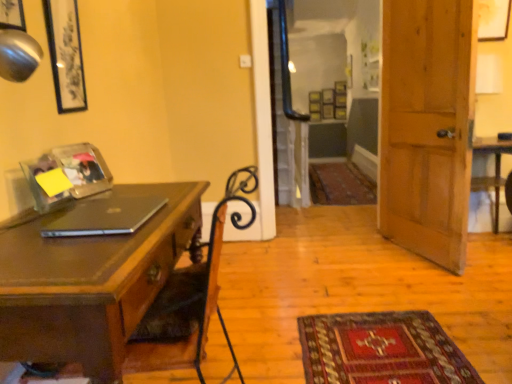
The width and height of the screenshot is (512, 384). Find the location of `clear glass screen door at upper center`. clear glass screen door at upper center is located at coordinates (286, 120).

In order to face carpeted mat at center, should I rotate leftwards or rightwards?

Turn right by 10.792 degrees to look at carpeted mat at center.

Image resolution: width=512 pixels, height=384 pixels. What do you see at coordinates (41, 185) in the screenshot?
I see `clear plastic picture frame at left, the second picture frame viewed from the front` at bounding box center [41, 185].

Describe the element at coordinates (83, 169) in the screenshot. I see `clear plastic picture frame at upper left, which appears as the third picture frame when viewed from the front` at that location.

How much space does clear plastic picture frame at upper left, which is the 2th picture frame from right to left, occupy vertically?

The height of clear plastic picture frame at upper left, which is the 2th picture frame from right to left, is 9.89 inches.

Find the location of a particular element. The height and width of the screenshot is (384, 512). clear glass screen door at upper center is located at coordinates (286, 120).

Is point (109, 301) farther from camera compared to point (57, 163)?

No, (109, 301) is in front of (57, 163).

Considering the relative positions of wooden desk at left and clear plastic picture frame at upper left, which is the 2th picture frame from right to left, in the image provided, is wooden desk at left to the right of clear plastic picture frame at upper left, which is the 2th picture frame from right to left, from the viewer's perspective?

Yes, wooden desk at left is to the right of clear plastic picture frame at upper left, which is the 2th picture frame from right to left.

Could you tell me if wooden desk at left is facing clear plastic picture frame at upper left, which appears as the fourth picture frame when viewed from the left?

No, wooden desk at left is not facing towards clear plastic picture frame at upper left, which appears as the fourth picture frame when viewed from the left.

From the image's perspective, starting from the wooden desk at left, which picture frame is the 2nd one above? Please provide its 2D coordinates.

[(83, 169)]

From a real-world perspective, is wooden picture frame at upper right, arranged as the fifth picture frame when viewed from the left, positioned over sleek black laptop at left based on gravity?

Yes, from a real-world perspective, wooden picture frame at upper right, arranged as the fifth picture frame when viewed from the left, is over sleek black laptop at left

Is wooden picture frame at upper right, positioned as the first picture frame in back-to-front order, next to sleek black laptop at left and touching it?

wooden picture frame at upper right, positioned as the first picture frame in back-to-front order, is not next to sleek black laptop at left, and they're not touching.

Would you say sleek black laptop at left is part of wooden picture frame at upper right, the first picture frame positioned from the right,'s contents?

No, sleek black laptop at left is not surrounded by wooden picture frame at upper right, the first picture frame positioned from the right.

Is there a large distance between clear glass screen door at upper center and clear plastic picture frame at left, the second picture frame viewed from the front?

Yes, clear glass screen door at upper center and clear plastic picture frame at left, the second picture frame viewed from the front, are quite far apart.

Is the depth of clear glass screen door at upper center less than that of clear plastic picture frame at left, marked as the 3th picture frame in a right-to-left arrangement?

No, clear glass screen door at upper center is further to the viewer.

From the image's perspective, is clear glass screen door at upper center on top of clear plastic picture frame at left, marked as the fourth picture frame in a back-to-front arrangement?

Yes.

How far apart are clear glass screen door at upper center and clear plastic picture frame at left, the second picture frame viewed from the front?

A distance of 8.92 feet exists between clear glass screen door at upper center and clear plastic picture frame at left, the second picture frame viewed from the front.

Which of these two, wooden desk at left or matte black picture frame at upper left, which is counted as the 5th picture frame, starting from the right, stands taller?

With more height is wooden desk at left.

Who is more distant, wooden desk at left or matte black picture frame at upper left, the 1th picture frame from the front?

matte black picture frame at upper left, the 1th picture frame from the front, is further away from the camera.

Could you measure the distance between wooden desk at left and matte black picture frame at upper left, the fifth picture frame in the back-to-front sequence?

wooden desk at left and matte black picture frame at upper left, the fifth picture frame in the back-to-front sequence, are 24.80 inches apart.

Does point (9, 247) appear closer or farther from the camera than point (9, 27)?

Point (9, 247).

From a real-world perspective, is wooden door at right over matte black picture frame at upper left, which is the fourth picture frame from front to back?

Actually, wooden door at right is physically below matte black picture frame at upper left, which is the fourth picture frame from front to back, in the real world.

Considering the positions of objects wooden door at right and matte black picture frame at upper left, which is the fourth picture frame from front to back, in the image provided, who is in front, wooden door at right or matte black picture frame at upper left, which is the fourth picture frame from front to back,?

matte black picture frame at upper left, which is the fourth picture frame from front to back, is closer to the camera.

Is point (389, 224) positioned before point (76, 94)?

No, (389, 224) is further to viewer.

From the image's perspective, is wooden door at right located beneath matte black picture frame at upper left, marked as the second picture frame in a back-to-front arrangement?

Correct, wooden door at right appears lower than matte black picture frame at upper left, marked as the second picture frame in a back-to-front arrangement, in the image.

Which of these two, matte black picture frame at upper left, which appears as the first picture frame when viewed from the left, or matte black picture frame at upper left, which is the fourth picture frame from front to back, is wider?

matte black picture frame at upper left, which appears as the first picture frame when viewed from the left, is wider.

Does matte black picture frame at upper left, the 1th picture frame from the front, turn towards matte black picture frame at upper left, which is the fourth picture frame from front to back?

No.

Could you measure the distance between matte black picture frame at upper left, the 1th picture frame from the front, and matte black picture frame at upper left, which is the fourth picture frame from front to back?

They are 20.84 inches apart.

Is clear plastic picture frame at left, marked as the 3th picture frame in a right-to-left arrangement, oriented away from clear plastic picture frame at upper left, which appears as the third picture frame when viewed from the front?

No.

From the image's perspective, is clear plastic picture frame at left, the second picture frame viewed from the front, over clear plastic picture frame at upper left, which is the third picture frame in back-to-front order?

No, from the image's perspective, clear plastic picture frame at left, the second picture frame viewed from the front, is not above clear plastic picture frame at upper left, which is the third picture frame in back-to-front order.

From a real-world perspective, is clear plastic picture frame at left, marked as the 3th picture frame in a right-to-left arrangement, located higher than clear plastic picture frame at upper left, which appears as the third picture frame when viewed from the front?

No, from a real-world perspective, clear plastic picture frame at left, marked as the 3th picture frame in a right-to-left arrangement, is not over clear plastic picture frame at upper left, which appears as the third picture frame when viewed from the front

In terms of width, does clear plastic picture frame at left, marked as the fourth picture frame in a back-to-front arrangement, look wider or thinner when compared to clear plastic picture frame at upper left, which is the third picture frame in back-to-front order?

Considering their sizes, clear plastic picture frame at left, marked as the fourth picture frame in a back-to-front arrangement, looks slimmer than clear plastic picture frame at upper left, which is the third picture frame in back-to-front order.

This screenshot has width=512, height=384. Find the location of `desk lying on the right of clear plastic picture frame at upper left, which appears as the fourth picture frame when viewed from the left`. desk lying on the right of clear plastic picture frame at upper left, which appears as the fourth picture frame when viewed from the left is located at coordinates (91, 284).

The width and height of the screenshot is (512, 384). Find the location of `picture frame that is the 5th one when counting upward from the sleek black laptop at left (from the image's perspective)`. picture frame that is the 5th one when counting upward from the sleek black laptop at left (from the image's perspective) is located at coordinates (493, 19).

From the picture: From the image, which object appears to be farther from wooden picture frame at upper right, arranged as the fifth picture frame when viewed from the left, wooden desk at left or clear glass screen door at upper center?

Based on the image, wooden desk at left appears to be further to wooden picture frame at upper right, arranged as the fifth picture frame when viewed from the left.

Looking at the image, which one is located closer to matte black picture frame at upper left, which appears as the first picture frame when viewed from the left, clear plastic picture frame at left, which is the 3th picture frame from left to right, or carpeted mat at center?

Based on the image, clear plastic picture frame at left, which is the 3th picture frame from left to right, appears to be nearer to matte black picture frame at upper left, which appears as the first picture frame when viewed from the left.

Estimate the real-world distances between objects in this image. Which object is closer to matte black picture frame at upper left, marked as the second picture frame in a back-to-front arrangement, wooden door at right or clear glass screen door at upper center?

wooden door at right is closer to matte black picture frame at upper left, marked as the second picture frame in a back-to-front arrangement.

Looking at this image, based on their spatial positions, is clear plastic picture frame at upper left, which appears as the fourth picture frame when viewed from the left, or wooden picture frame at upper right, arranged as the fifth picture frame when viewed from the left, closer to wooden desk at left?

clear plastic picture frame at upper left, which appears as the fourth picture frame when viewed from the left.

Based on their spatial positions, is wooden door at right or matte black picture frame at upper left, which is counted as the 5th picture frame, starting from the right, closer to clear glass screen door at upper center?

wooden door at right.

Looking at the image, which one is located further to clear plastic picture frame at upper left, which appears as the fourth picture frame when viewed from the left, matte black picture frame at upper left, which appears as the first picture frame when viewed from the left, or carpeted mat at center?

carpeted mat at center.

From the image, which object appears to be farther from wooden picture frame at upper right, which ranks as the 5th picture frame in front-to-back order, matte black picture frame at upper left, which is the fourth picture frame from front to back, or wooden door at right?

matte black picture frame at upper left, which is the fourth picture frame from front to back.

Based on their spatial positions, is wooden picture frame at upper right, positioned as the first picture frame in back-to-front order, or clear glass screen door at upper center closer to clear plastic picture frame at left, which is the 3th picture frame from left to right?

clear glass screen door at upper center.

Locate an element on the screen. This screenshot has width=512, height=384. screen door between matte black picture frame at upper left, which is the fourth picture frame from front to back, and wooden picture frame at upper right, arranged as the fifth picture frame when viewed from the left, from left to right is located at coordinates (286, 120).

Locate an element on the screen. The height and width of the screenshot is (384, 512). laptop positioned between wooden desk at left and carpeted mat at center from near to far is located at coordinates (105, 217).

The image size is (512, 384). In order to click on door between sleek black laptop at left and carpeted mat at center in the front-back direction in this screenshot , I will do `click(426, 127)`.

The image size is (512, 384). What are the coordinates of `screen door positioned between clear plastic picture frame at left, marked as the 3th picture frame in a right-to-left arrangement, and carpeted mat at center from near to far` in the screenshot? It's located at coord(286,120).